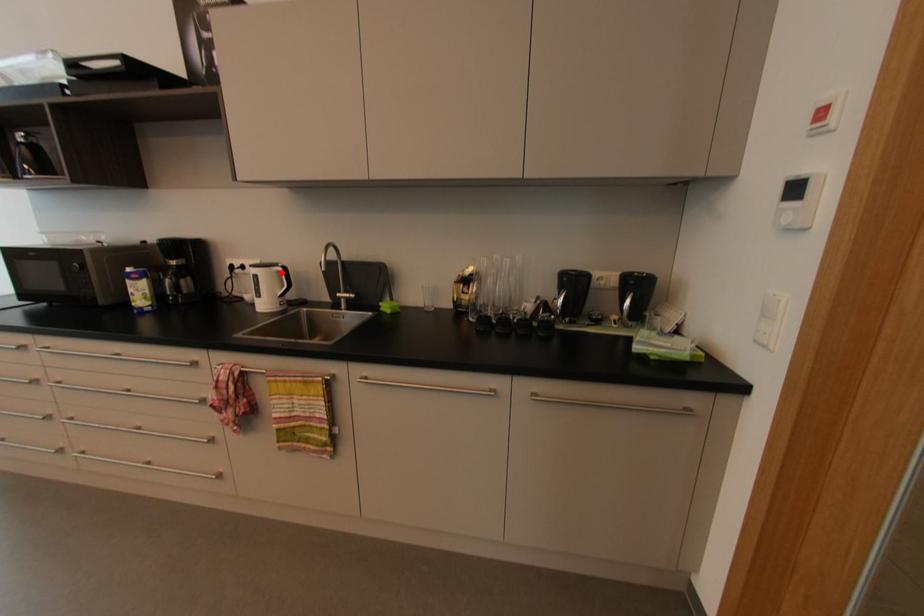
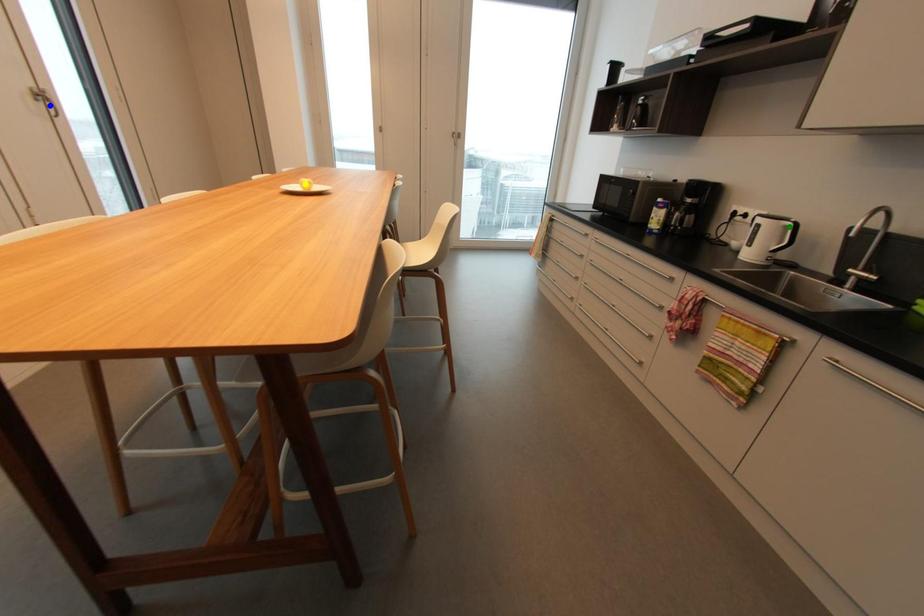
Question: I am providing you with two images of the same scene from different viewpoints. A red point is marked on the first image. You are given multiple points on the second image. Which spot in image 2 lines up with the point in image 1?

Choices:
 (A) blue point
 (B) green point
 (C) yellow point

Answer: (B)